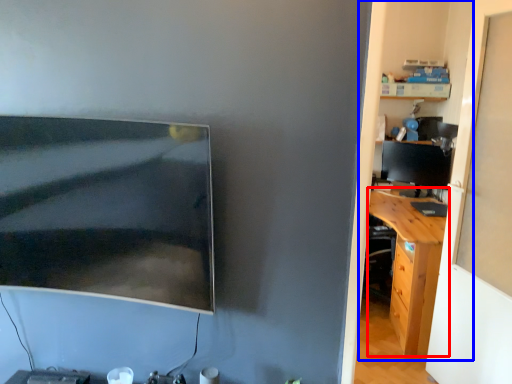
Question: Among these objects, which one is nearest to the camera, desk (highlighted by a red box) or dresser (highlighted by a blue box)?

Choices:
 (A) desk
 (B) dresser

Answer: (B)